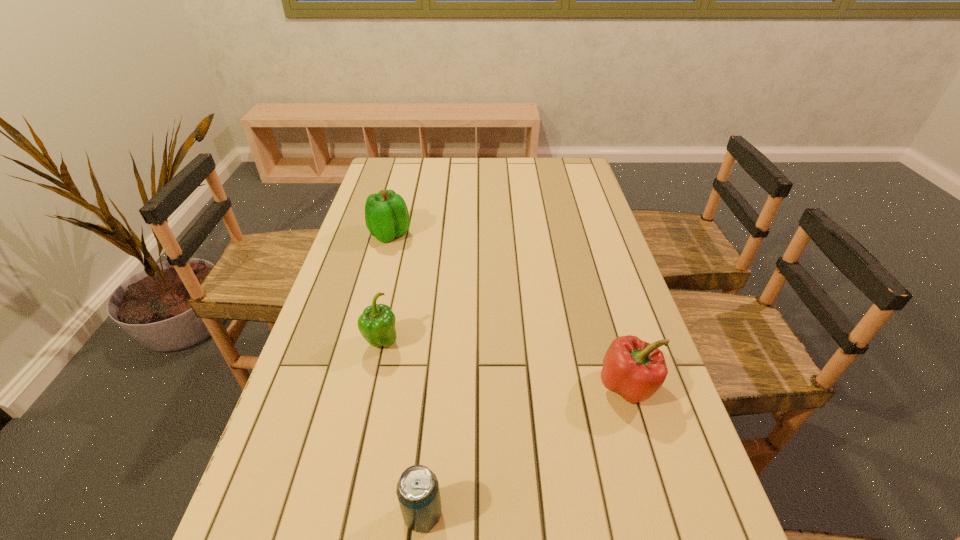
Identify the location of object that is at the right edge. (634, 369).

This screenshot has width=960, height=540. I want to click on free space at the far edge of the desktop, so click(423, 159).

Locate an element on the screen. The width and height of the screenshot is (960, 540). vacant area at the left edge is located at coordinates (376, 260).

The height and width of the screenshot is (540, 960). In the image, there is a desktop. In order to click on vacant space at the right edge in this screenshot , I will do `click(590, 256)`.

The image size is (960, 540). Find the location of `free region at the far right corner`. free region at the far right corner is located at coordinates (550, 179).

Where is `free spot between the second nearest bell pepper and the rightmost object`? free spot between the second nearest bell pepper and the rightmost object is located at coordinates (505, 364).

You are a GUI agent. You are given a task and a screenshot of the screen. Output one action in this format:
    pyautogui.click(x=<x>, y=<y>)
    Task: Click on the free space between the third nearest object and the farthest object
    
    Given the screenshot: What is the action you would take?
    pyautogui.click(x=386, y=288)

I want to click on free space between the rightmost bell pepper and the third nearest object, so click(505, 364).

This screenshot has width=960, height=540. I want to click on free point between the second nearest bell pepper and the soda can, so click(x=402, y=428).

Locate an element on the screen. This screenshot has width=960, height=540. vacant space that's between the second nearest bell pepper and the farthest bell pepper is located at coordinates (386, 288).